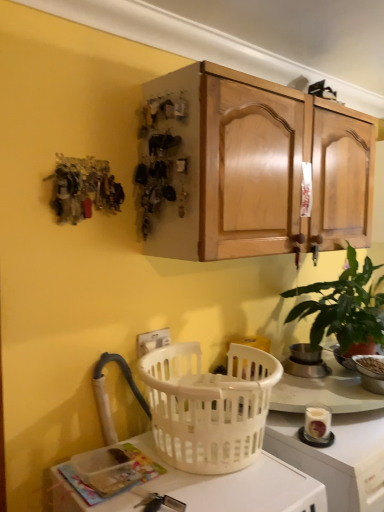
Question: From the image's perspective, is white plastic picnic basket at lower center above or below white plastic bowl at lower right, positioned as the 1th appliance in right-to-left order?

Choices:
 (A) below
 (B) above

Answer: (B)

Question: Considering the positions of white plastic picnic basket at lower center and white plastic bowl at lower right, the second appliance positioned from the left, in the image, is white plastic picnic basket at lower center taller or shorter than white plastic bowl at lower right, the second appliance positioned from the left,?

Choices:
 (A) short
 (B) tall

Answer: (B)

Question: Estimate the real-world distances between objects in this image. Which object is closer to the white plastic basket at lower center?

Choices:
 (A) white plastic electric outlet at lower center
 (B) green matte plant at right
 (C) white plastic picnic basket at lower center
 (D) metallic silver pot at upper right, positioned as the first appliance in left-to-right order
 (E) white plastic bowl at lower right, the second appliance positioned from the left

Answer: (C)

Question: Based on their relative distances, which object is farther from the white plastic picnic basket at lower center?

Choices:
 (A) white plastic bowl at lower right, the second appliance positioned from the left
 (B) white plastic electric outlet at lower center
 (C) green matte plant at right
 (D) metallic silver pot at upper right, which appears as the second appliance when viewed from the right
 (E) white plastic basket at lower center

Answer: (A)